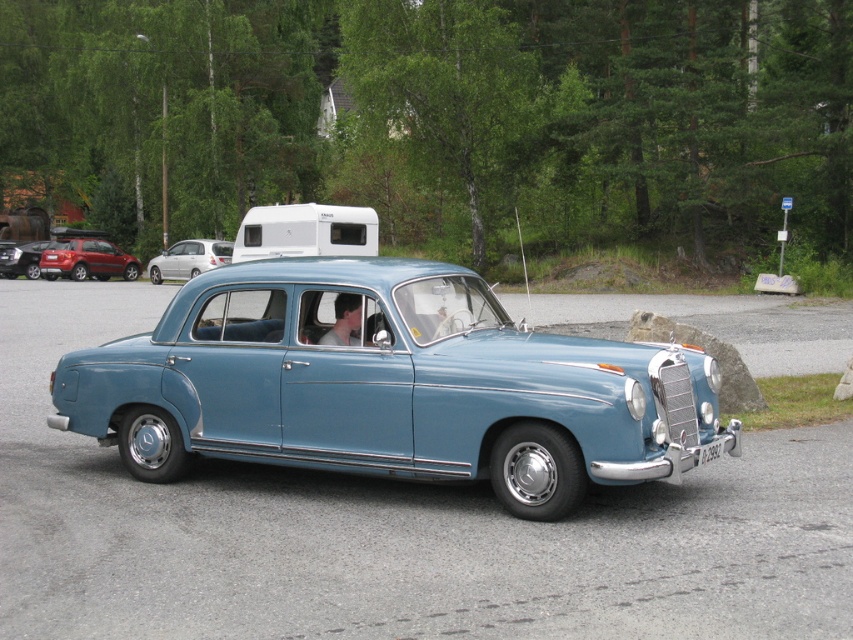
Who is higher up, metallic red suv at left or silver metallic hatchback at left?

metallic red suv at left is higher up.

Is metallic red suv at left shorter than silver metallic hatchback at left?

Incorrect, metallic red suv at left's height does not fall short of silver metallic hatchback at left's.

Does point (123, 253) come in front of point (181, 248)?

That is False.

Where is `metallic red suv at left`? This screenshot has height=640, width=853. metallic red suv at left is located at coordinates (86, 259).

Does metallic red suv at left have a smaller size compared to black plastic license plate at center?

No, metallic red suv at left is not smaller than black plastic license plate at center.

Between point (85, 260) and point (722, 445), which one is positioned behind?

Point (85, 260)

Between point (71, 264) and point (711, 454), which one is positioned behind?

Positioned behind is point (71, 264).

Identify the location of metallic red suv at left. (86, 259).

Which is more to the left, light blue metallic car at center or matte black car at lower left?

matte black car at lower left is more to the left.

Does light blue metallic car at center have a larger size compared to matte black car at lower left?

Indeed, light blue metallic car at center has a larger size compared to matte black car at lower left.

Identify the location of light blue metallic car at center. This screenshot has width=853, height=640. (389, 387).